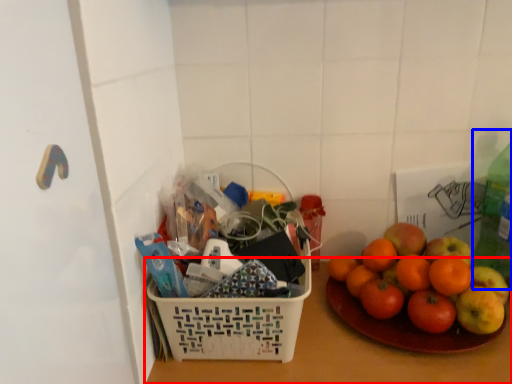
Question: Which point is further to the camera, table top (highlighted by a red box) or bottle (highlighted by a blue box)?

Choices:
 (A) table top
 (B) bottle

Answer: (B)